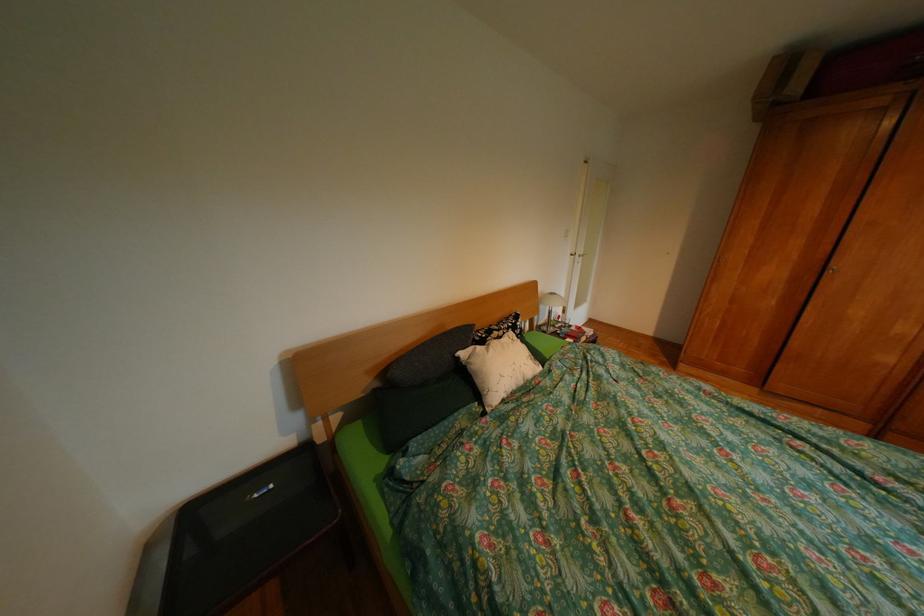
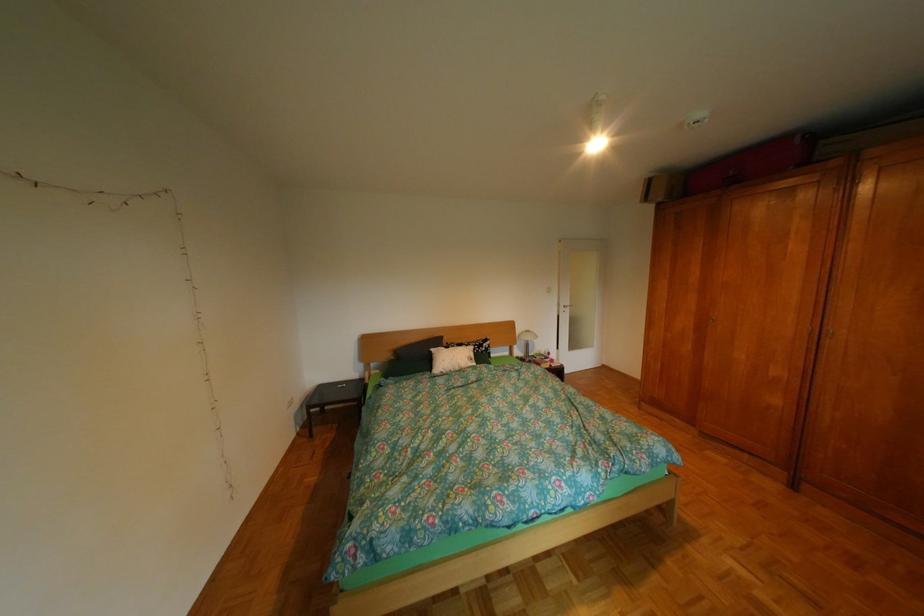
Which direction would the cameraman need to move to produce the second image?

The cameraman walked toward right, backward.